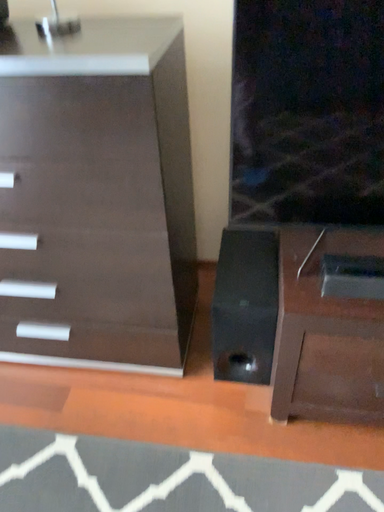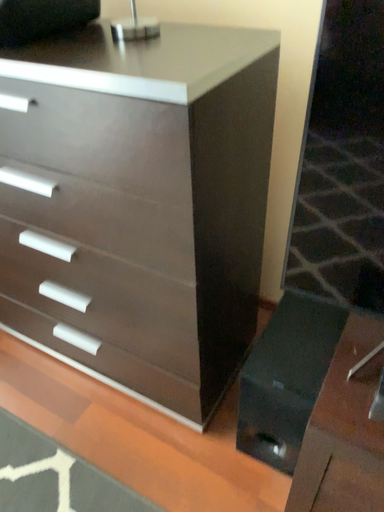
Question: Which way did the camera rotate in the video?

Choices:
 (A) rotated right
 (B) rotated left

Answer: (B)